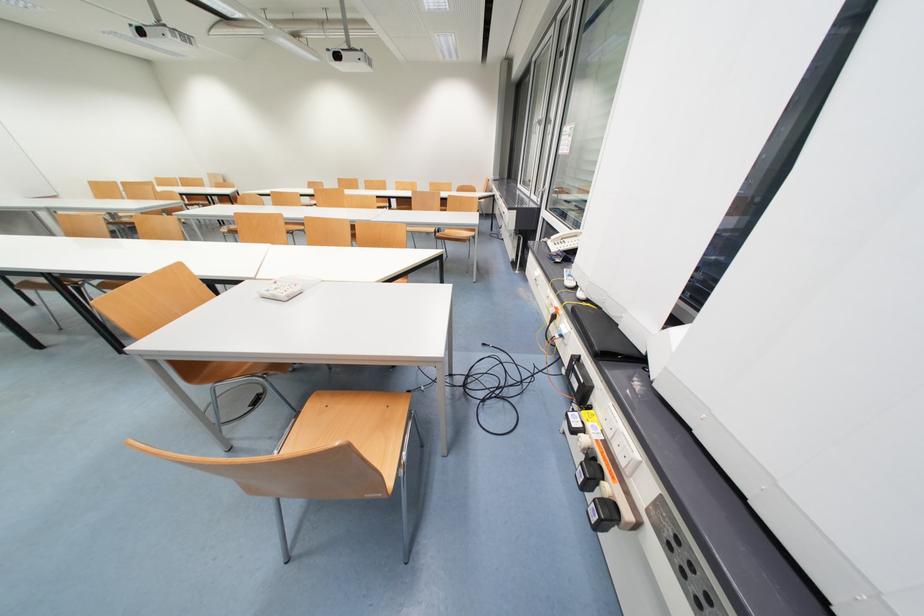
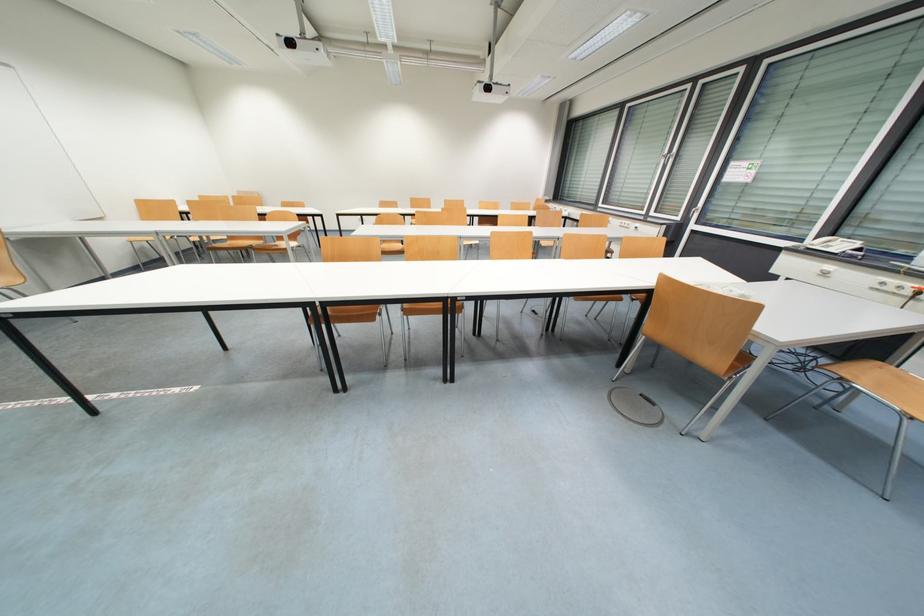
Question: In a continuous first-person perspective shot, in which direction is the camera moving?

Choices:
 (A) Left
 (B) Right
 (C) Forward
 (D) Backward

Answer: (A)